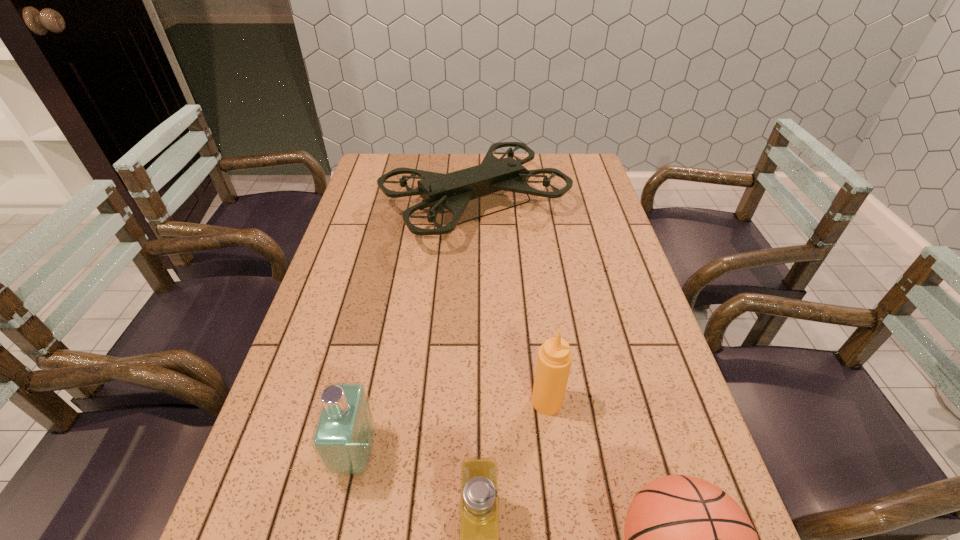
Point out which object is positioned as the fourth nearest to the right perfume. Please provide its 2D coordinates. Your answer should be formatted as a tuple, i.e. [(x, y)], where the tuple contains the x and y coordinates of a point satisfying the conditions above.

[(452, 191)]

This screenshot has height=540, width=960. I want to click on object that stands as the fourth closest to the fourth nearest object, so pos(452,191).